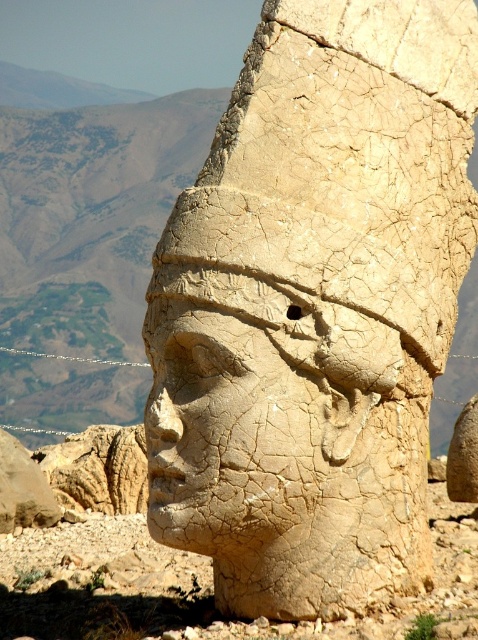
Measure the distance between cracked stone head at center and cracked stone face at center.

cracked stone head at center is 9.20 feet away from cracked stone face at center.

You are a GUI agent. You are given a task and a screenshot of the screen. Output one action in this format:
    pyautogui.click(x=<x>, y=<y>)
    Task: Click on the cracked stone head at center
    
    Given the screenshot: What is the action you would take?
    pyautogui.click(x=315, y=307)

Does point (338, 429) come behind point (235, 394)?

Yes, it is behind point (235, 394).

Locate an element on the screen. The height and width of the screenshot is (640, 478). cracked stone head at center is located at coordinates (315, 307).